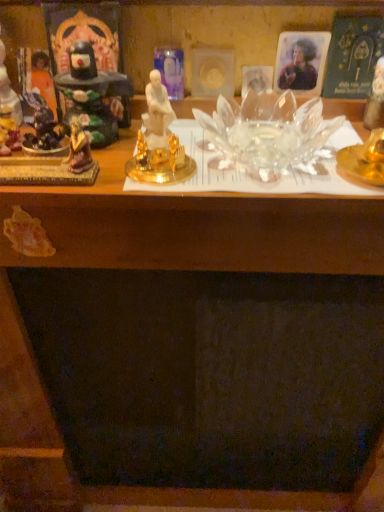
Question: Based on their positions, is orange fabric statue at left, which ranks as the 1th person in left-to-right order, located to the left or right of transparent glass bowl at center?

Choices:
 (A) left
 (B) right

Answer: (A)

Question: In the image, is orange fabric statue at left, the 2th person when ordered from right to left, positioned in front of or behind transparent glass bowl at center?

Choices:
 (A) front
 (B) behind

Answer: (B)

Question: Which object is the farthest from the transparent glass bowl at center?

Choices:
 (A) matte black statue at left, which is counted as the third toy, starting from the left
 (B) matte plastic photo at upper right, which is the first person from right to left
 (C) transparent glass candle at upper right, the fourth toy positioned from the left
 (D) matte purple figurine at left, the second toy positioned from the left
 (E) matte black statue at left, which is the 4th toy from right to left

Answer: (E)

Question: Considering the real-world distances, which object is farthest from the matte plastic photo at upper right, which is the first person from right to left?

Choices:
 (A) matte purple figurine at left, the second toy positioned from the left
 (B) transparent glass bowl at center
 (C) matte black statue at left, which is the 4th toy from right to left
 (D) orange fabric statue at left, which ranks as the 1th person in left-to-right order
 (E) transparent glass candle at upper right, acting as the 1th toy starting from the right

Answer: (C)